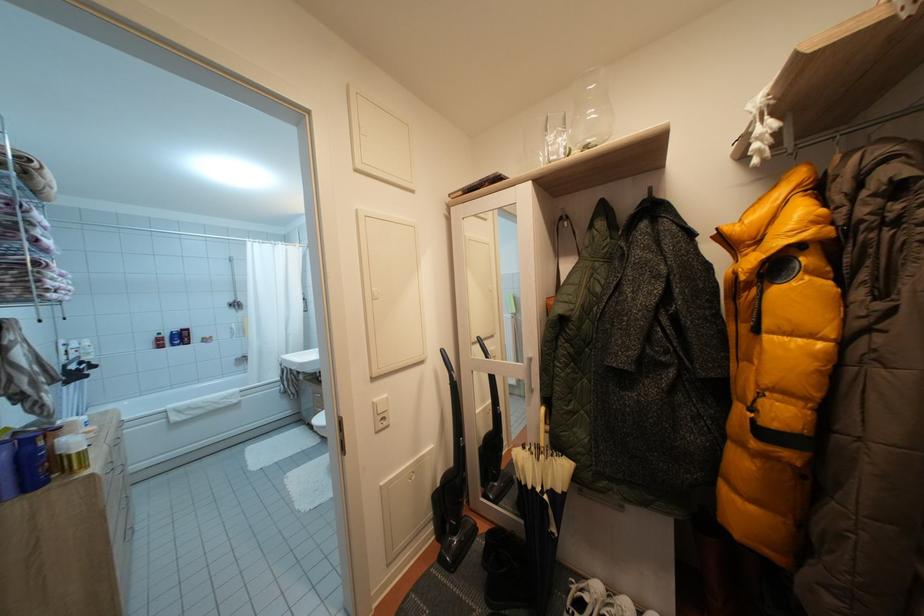
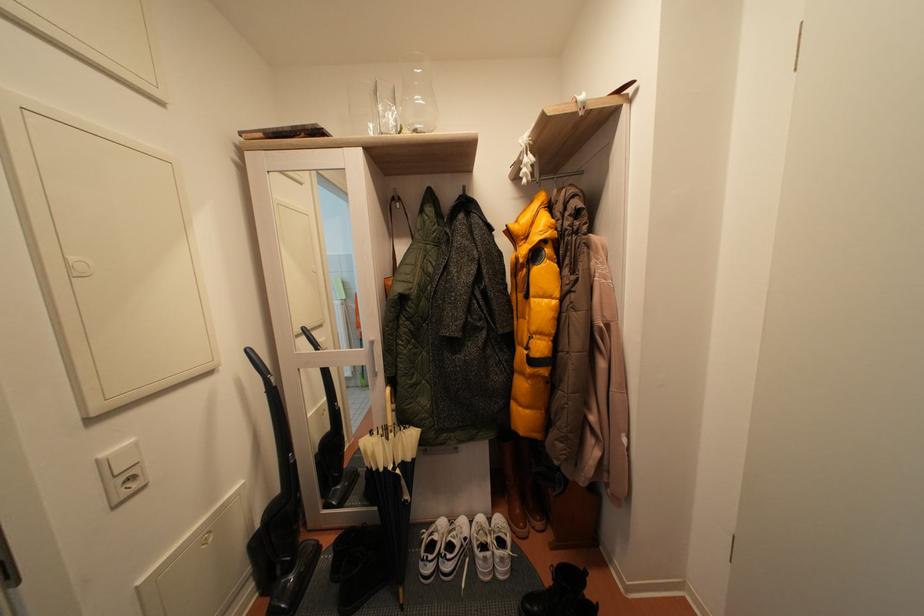
Find the pixel in the second image that matches (762,152) in the first image.

(531, 176)